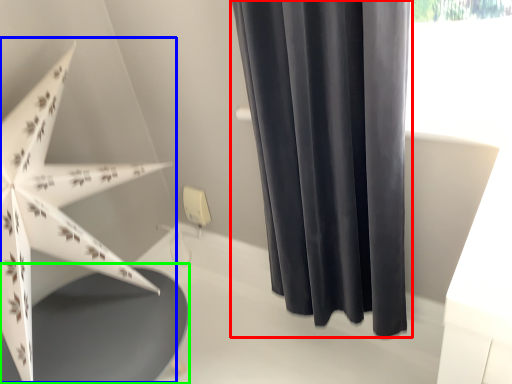
Question: Which object is the closest to the curtain (highlighted by a red box)? Choose among these: umbrella (highlighted by a blue box) or round table (highlighted by a green box).

Choices:
 (A) umbrella
 (B) round table

Answer: (A)